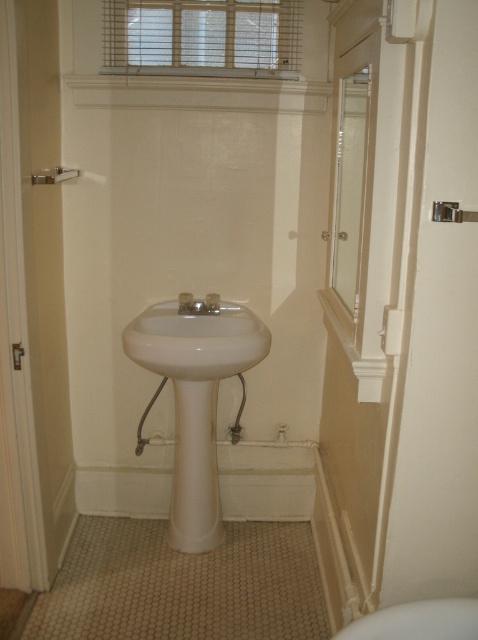
Question: Does white glossy toilet bowl at lower right appear on the left side of brushed metal shower at upper left?

Choices:
 (A) yes
 (B) no

Answer: (B)

Question: Is white glossy pedestal sink at center to the left of clear glass screen door at right from the viewer's perspective?

Choices:
 (A) no
 (B) yes

Answer: (B)

Question: Among these objects, which one is farthest from the camera?

Choices:
 (A) matte silver faucet at center
 (B) white glossy pedestal sink at center
 (C) clear glass screen door at right
 (D) white glossy toilet bowl at lower right

Answer: (A)

Question: Is white glossy pedestal sink at center to the right of white glossy toilet bowl at lower right from the viewer's perspective?

Choices:
 (A) no
 (B) yes

Answer: (A)

Question: Which of these objects is positioned farthest from the brushed metal shower at upper left?

Choices:
 (A) white glossy pedestal sink at center
 (B) matte silver faucet at center
 (C) white glossy toilet bowl at lower right

Answer: (C)

Question: Which of these objects is positioned farthest from the matte silver faucet at center?

Choices:
 (A) brushed metal shower at upper left
 (B) clear glass screen door at right
 (C) white glossy toilet bowl at lower right

Answer: (C)